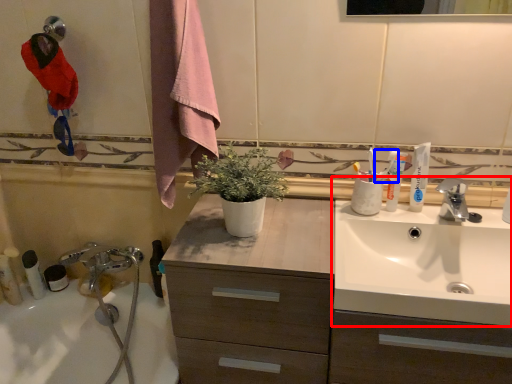
Question: Which point is closer to the camera, sink (highlighted by a red box) or toothpaste (highlighted by a blue box)?

Choices:
 (A) sink
 (B) toothpaste

Answer: (A)